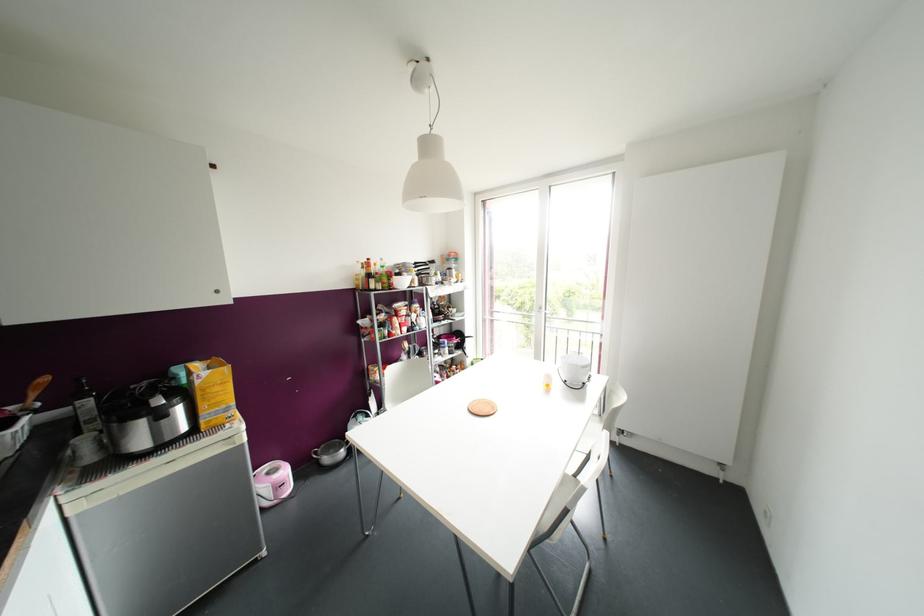
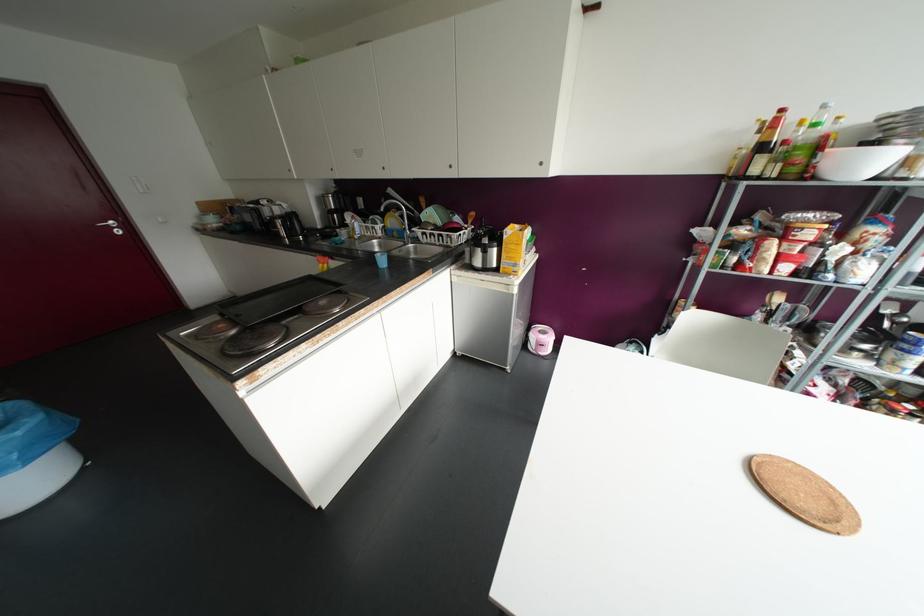
Find the pixel in the second image that matches point (381, 259) in the first image.

(823, 106)